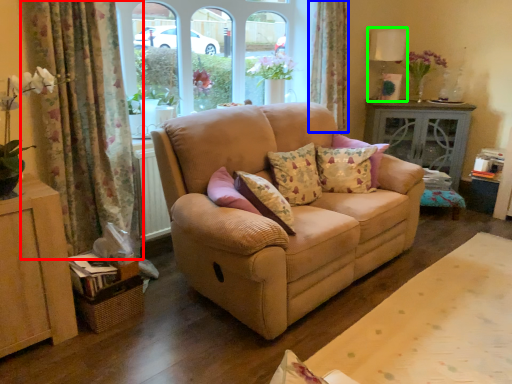
Question: Which object is the farthest from curtain (highlighted by a red box)? Choose among these: curtain (highlighted by a blue box) or lamp (highlighted by a green box).

Choices:
 (A) curtain
 (B) lamp

Answer: (B)